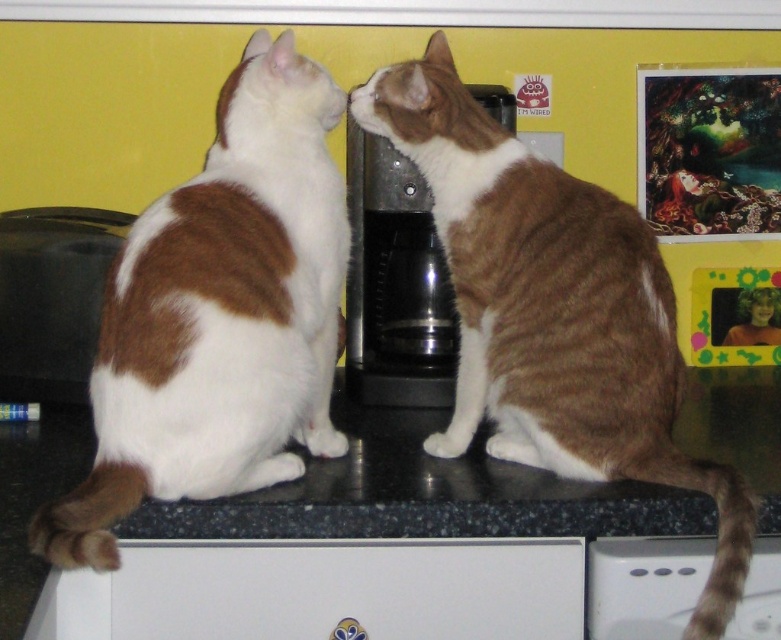
Does brown and white fur cat at left appear on the right side of black plastic coffee machine at center?

No, brown and white fur cat at left is not to the right of black plastic coffee machine at center.

Does point (321, 284) come in front of point (423, 198)?

That is True.

This screenshot has height=640, width=781. I want to click on brown and white fur cat at left, so click(x=219, y=314).

Does point (305, 294) come farther from viewer compared to point (751, 304)?

No, it is in front of (751, 304).

This screenshot has width=781, height=640. I want to click on brown and white fur cat at left, so click(x=219, y=314).

Can you confirm if black plastic coffee machine at center is shorter than blonde hair at upper right?

Incorrect, black plastic coffee machine at center's height does not fall short of blonde hair at upper right's.

Locate an element on the screen. Image resolution: width=781 pixels, height=640 pixels. black plastic coffee machine at center is located at coordinates (394, 284).

The height and width of the screenshot is (640, 781). I want to click on black plastic coffee machine at center, so click(394, 284).